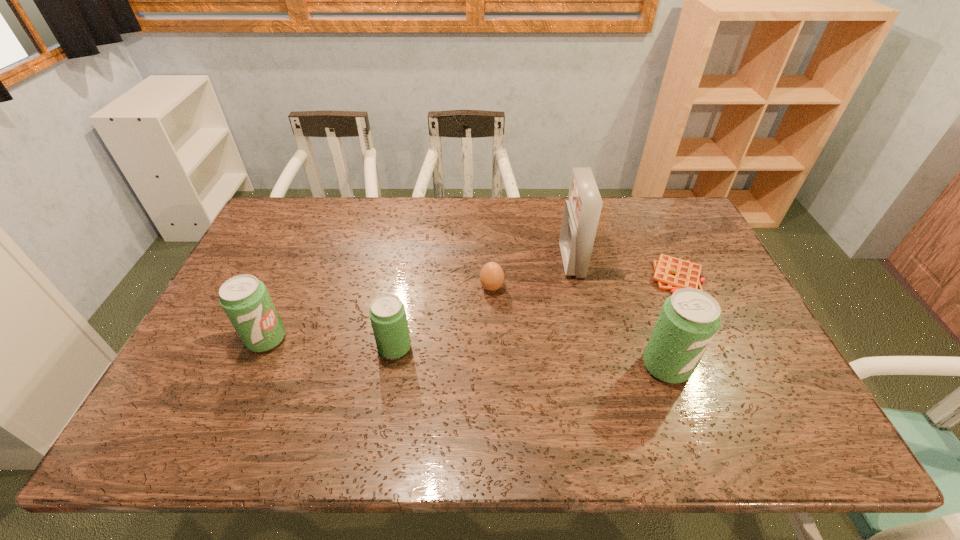
Find the location of a particular element. This screenshot has width=960, height=540. free space that satisfies the following two spatial constraints: 1. on the back side of the waffle; 2. on the right side of the leftmost soda is located at coordinates (293, 277).